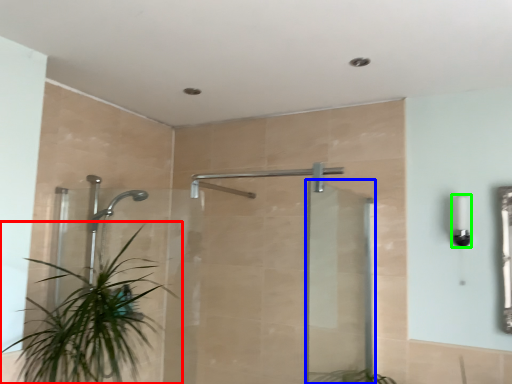
Question: Estimate the real-world distances between objects in this image. Which object is farther from houseplant (highlighted by a red box), screen door (highlighted by a blue box) or light fixture (highlighted by a green box)?

Choices:
 (A) screen door
 (B) light fixture

Answer: (B)